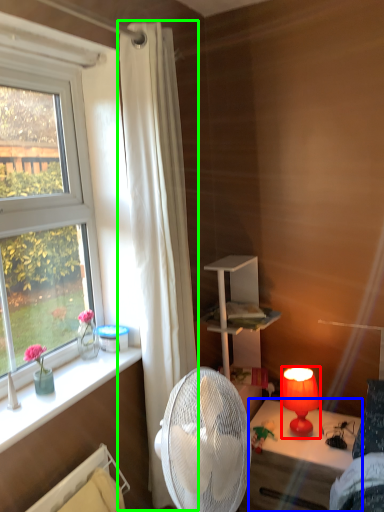
Question: Estimate the real-world distances between objects in this image. Which object is closer to lamp (highlighted by a red box), desk (highlighted by a blue box) or curtain (highlighted by a green box)?

Choices:
 (A) desk
 (B) curtain

Answer: (A)